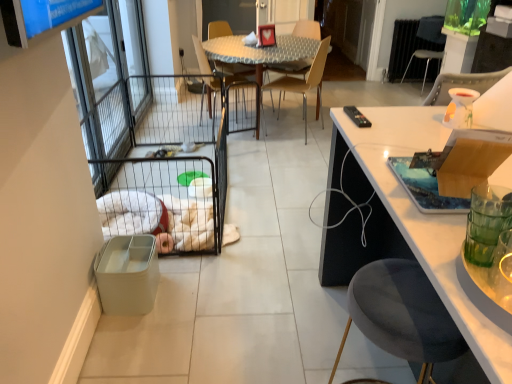
Locate an element on the screen. This screenshot has width=512, height=384. vacant space in front of light brown wood chair at center, arranged as the third chair when viewed from the back is located at coordinates (280, 145).